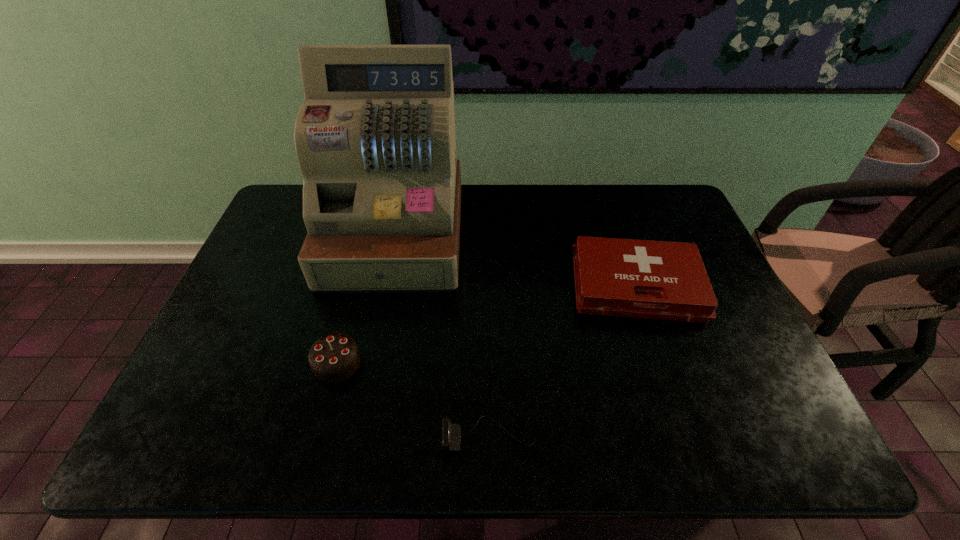
This screenshot has width=960, height=540. Find the location of `the tallest object`. the tallest object is located at coordinates (375, 139).

Locate an element on the screen. Image resolution: width=960 pixels, height=540 pixels. chocolate cake is located at coordinates (334, 357).

At what (x,y) coordinates should I click in order to perform the action: click on the third farthest object. Please return your answer as a coordinate pair (x, y). The height and width of the screenshot is (540, 960). Looking at the image, I should click on (334, 357).

In order to click on the rightmost object in this screenshot , I will do `click(662, 280)`.

Where is `the third tallest object`? The image size is (960, 540). the third tallest object is located at coordinates (662, 280).

Find the location of a particular element. the nearest object is located at coordinates (451, 433).

The width and height of the screenshot is (960, 540). What are the coordinates of `the shortest object` in the screenshot? It's located at [x=451, y=433].

Identify the location of vacant position located on the operating side of the tallest object. Image resolution: width=960 pixels, height=540 pixels. (369, 362).

You are a GUI agent. You are given a task and a screenshot of the screen. Output one action in this format:
    pyautogui.click(x=<x>, y=<y>)
    Task: Click on the free space located 0.050m on the left of the chocolate cake
    
    Given the screenshot: What is the action you would take?
    pyautogui.click(x=293, y=362)

This screenshot has width=960, height=540. Identify the location of free location located 0.220m on the left of the third tallest object. (492, 286).